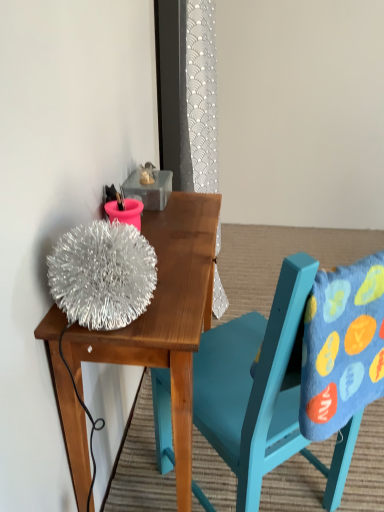
Question: From a real-world perspective, is shiny metallic ball at upper left physically above teal painted wood chair at upper center?

Choices:
 (A) no
 (B) yes

Answer: (A)

Question: From the image's perspective, is shiny metallic ball at upper left above teal painted wood chair at upper center?

Choices:
 (A) no
 (B) yes

Answer: (A)

Question: Is shiny metallic ball at upper left behind teal painted wood chair at upper center?

Choices:
 (A) yes
 (B) no

Answer: (A)

Question: Is teal painted wood chair at upper center at the back of shiny metallic ball at upper left?

Choices:
 (A) no
 (B) yes

Answer: (B)

Question: Is shiny metallic ball at upper left facing towards teal painted wood chair at upper center?

Choices:
 (A) yes
 (B) no

Answer: (A)

Question: Is blue felt pillow at right in front of or behind teal painted wood chair at upper center in the image?

Choices:
 (A) front
 (B) behind

Answer: (B)

Question: In terms of height, does blue felt pillow at right look taller or shorter compared to teal painted wood chair at upper center?

Choices:
 (A) short
 (B) tall

Answer: (A)

Question: Is point (327, 391) positioned closer to the camera than point (292, 334)?

Choices:
 (A) farther
 (B) closer

Answer: (A)

Question: From a real-world perspective, is blue felt pillow at right above or below teal painted wood chair at upper center?

Choices:
 (A) below
 (B) above

Answer: (B)

Question: Would you say blue felt pillow at right is to the left or to the right of shiny metallic ball at upper left in the picture?

Choices:
 (A) right
 (B) left

Answer: (A)

Question: In terms of width, does blue felt pillow at right look wider or thinner when compared to shiny metallic ball at upper left?

Choices:
 (A) thin
 (B) wide

Answer: (A)

Question: Considering the positions of blue felt pillow at right and shiny metallic ball at upper left in the image, is blue felt pillow at right bigger or smaller than shiny metallic ball at upper left?

Choices:
 (A) small
 (B) big

Answer: (A)

Question: Does point (306, 406) appear closer or farther from the camera than point (170, 281)?

Choices:
 (A) closer
 (B) farther

Answer: (A)

Question: From the image's perspective, is shiny metallic ball at upper left positioned above or below teal painted wood chair at upper center?

Choices:
 (A) above
 (B) below

Answer: (B)

Question: Considering their positions, is shiny metallic ball at upper left located in front of or behind teal painted wood chair at upper center?

Choices:
 (A) front
 (B) behind

Answer: (B)